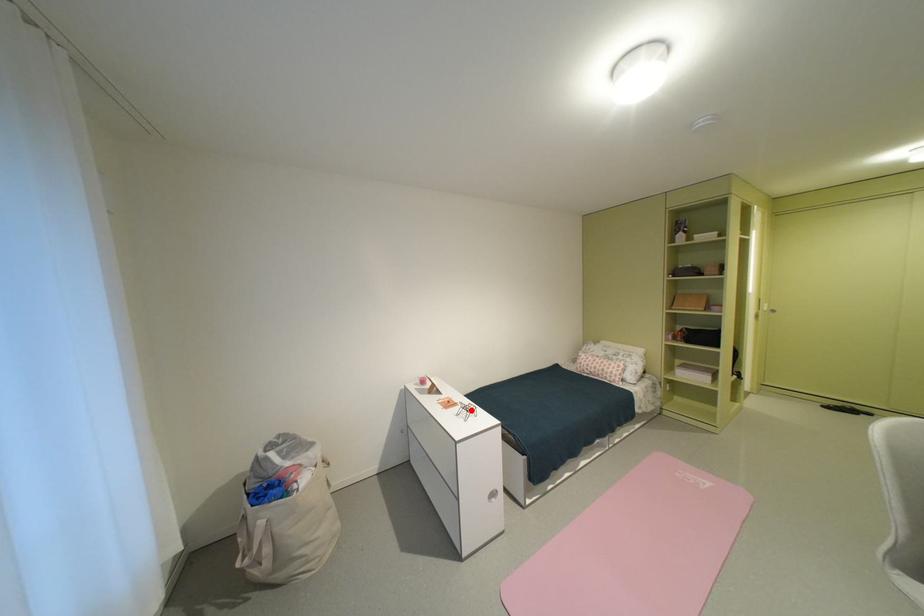
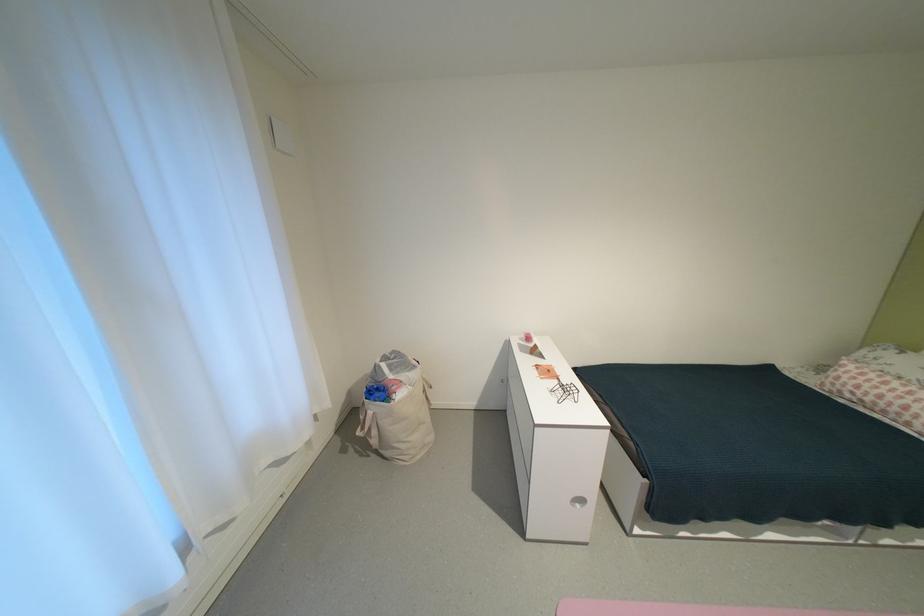
In the second image, find the point that corresponds to the highlighted location in the first image.

(568, 387)